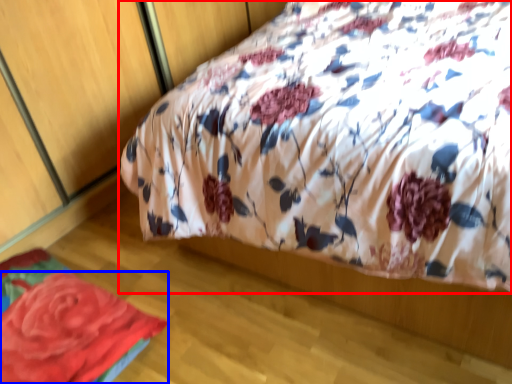
Question: Which object appears farthest to the camera in this image, bed (highlighted by a red box) or rose (highlighted by a blue box)?

Choices:
 (A) bed
 (B) rose

Answer: (B)